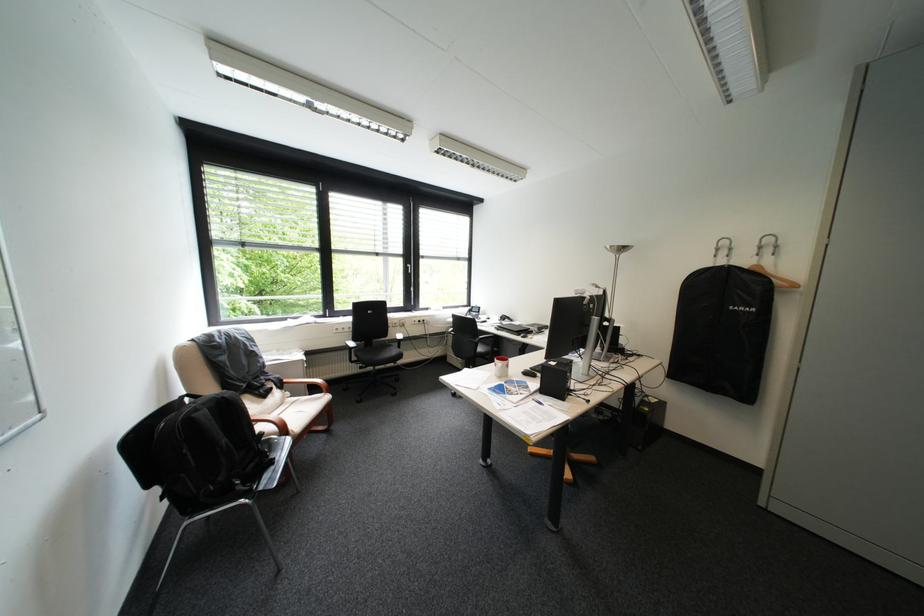
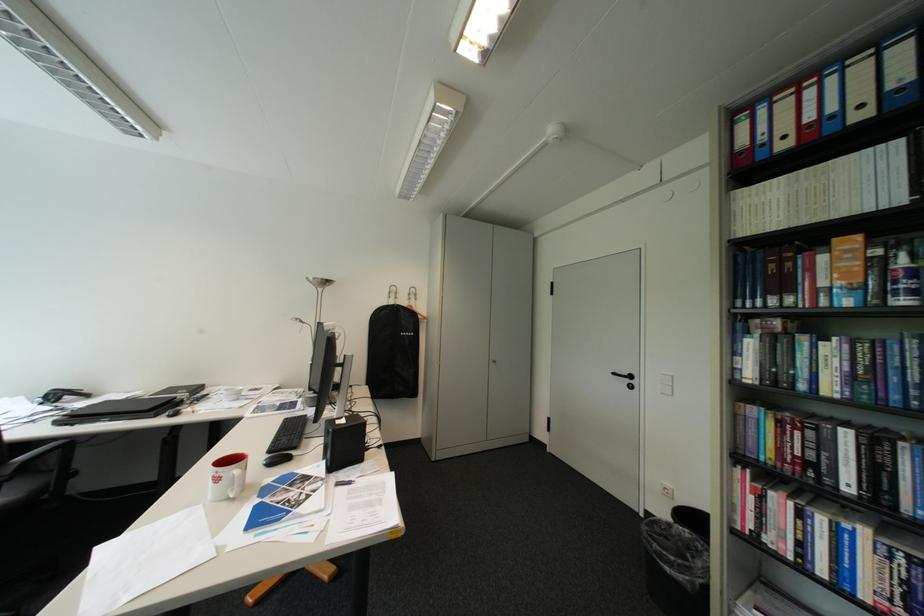
Question: The camera is either moving clockwise (left) or counter-clockwise (right) around the object. The first image is from the beginning of the video and the second image is from the end. Is the camera moving left or right when shooting the video?

Choices:
 (A) Left
 (B) Right

Answer: (A)